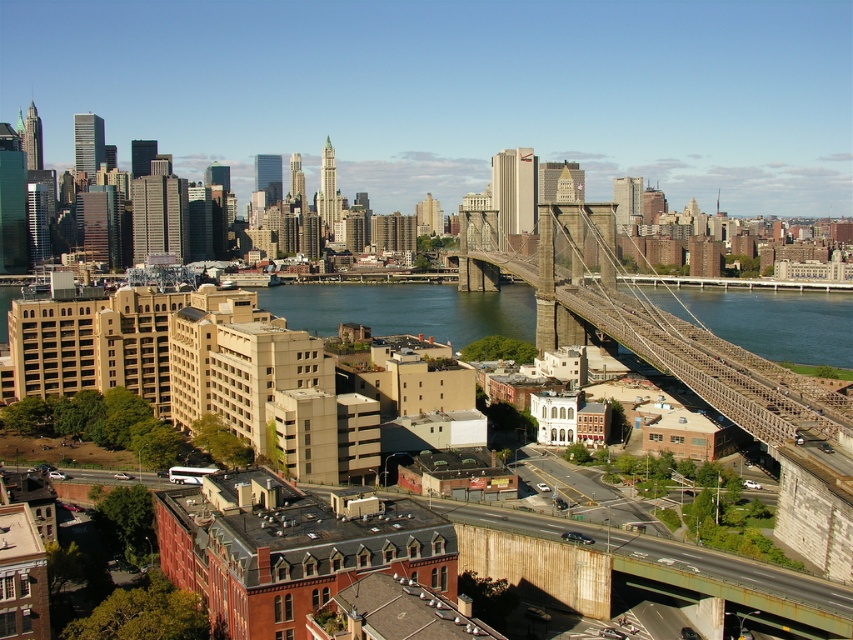
You are a photographer planning to capture a wide shot of the dark gray steel suspension bridge at center and the blue water at center in the image. Based on their sizes, which object should you focus on to ensure both are clearly visible in the frame?

The dark gray steel suspension bridge at center has a smaller size compared to blue water at center, so focusing on the bridge would allow both objects to be clearly visible since it occupies less space and the larger water area can still be captured in the frame.

You are a drone operator trying to capture a photo of the dark gray steel suspension bridge at center. Your drone is currently at the point with coordinates (648, 326). Can you confirm if your drone is positioned directly over the bridge?

The dark gray steel suspension bridge at center is located at point (648, 326), so yes, the drone is positioned directly over the bridge.

You are a photographer planning to capture the dark gray steel suspension bridge at center and the blue water at center in a single shot. Based on their positions and sizes, which object will appear larger in the photo?

The dark gray steel suspension bridge at center is taller than the blue water at center, so it will appear larger in the photo.